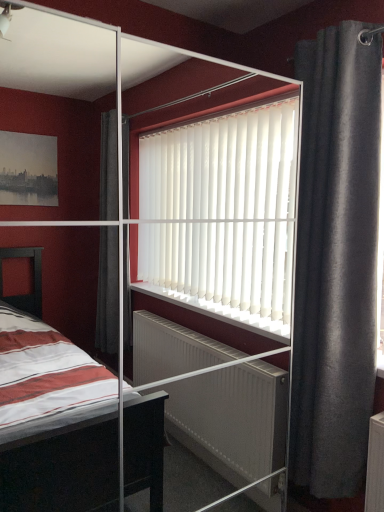
Question: Is transparent glass screen door at center inside dark gray fabric curtain at right?

Choices:
 (A) no
 (B) yes

Answer: (A)

Question: Can you confirm if dark gray fabric curtain at right is smaller than transparent glass screen door at center?

Choices:
 (A) yes
 (B) no

Answer: (A)

Question: From the image's perspective, does dark gray fabric curtain at right appear lower than transparent glass screen door at center?

Choices:
 (A) yes
 (B) no

Answer: (B)

Question: Is the position of dark gray fabric curtain at right less distant than that of transparent glass screen door at center?

Choices:
 (A) no
 (B) yes

Answer: (A)

Question: From the image's perspective, is dark gray fabric curtain at right on top of transparent glass screen door at center?

Choices:
 (A) no
 (B) yes

Answer: (B)

Question: Does dark gray fabric curtain at right have a greater height compared to transparent glass screen door at center?

Choices:
 (A) no
 (B) yes

Answer: (A)

Question: Considering the relative sizes of transparent glass screen door at center and dark gray fabric curtain at right in the image provided, is transparent glass screen door at center taller than dark gray fabric curtain at right?

Choices:
 (A) no
 (B) yes

Answer: (B)

Question: Does transparent glass screen door at center have a smaller size compared to dark gray fabric curtain at right?

Choices:
 (A) no
 (B) yes

Answer: (A)

Question: Is transparent glass screen door at center not inside dark gray fabric curtain at right?

Choices:
 (A) no
 (B) yes

Answer: (B)

Question: Could dark gray fabric curtain at right be considered to be inside transparent glass screen door at center?

Choices:
 (A) no
 (B) yes

Answer: (A)

Question: Does transparent glass screen door at center have a lesser height compared to dark gray fabric curtain at right?

Choices:
 (A) no
 (B) yes

Answer: (A)

Question: From a real-world perspective, is transparent glass screen door at center beneath dark gray fabric curtain at right?

Choices:
 (A) no
 (B) yes

Answer: (B)

Question: Considering the positions of dark gray fabric curtain at right and transparent glass screen door at center in the image, is dark gray fabric curtain at right wider or thinner than transparent glass screen door at center?

Choices:
 (A) thin
 (B) wide

Answer: (A)